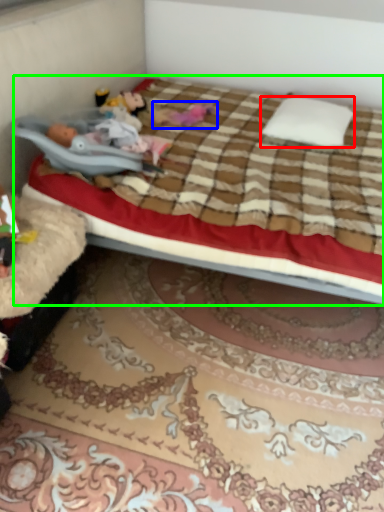
Question: Estimate the real-world distances between objects in this image. Which object is farther from pillow (highlighted by a red box), toy (highlighted by a blue box) or bed (highlighted by a green box)?

Choices:
 (A) toy
 (B) bed

Answer: (A)